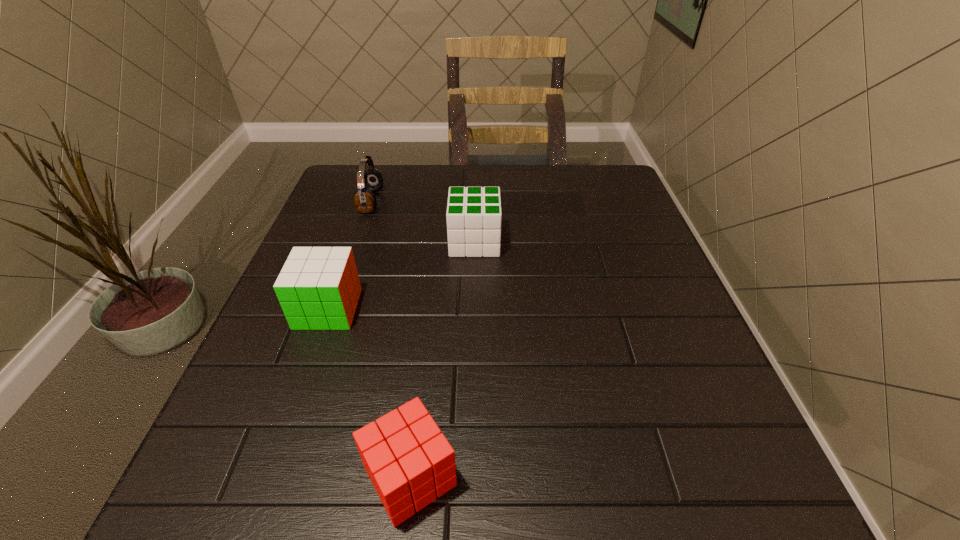
Where is `headset`? headset is located at coordinates (369, 180).

This screenshot has height=540, width=960. In order to click on the farthest cube in this screenshot , I will do pyautogui.click(x=473, y=215).

What are the coordinates of `the second nearest object` in the screenshot? It's located at (318, 288).

You are a GUI agent. You are given a task and a screenshot of the screen. Output one action in this format:
    pyautogui.click(x=<x>, y=<y>)
    Task: Click on the second farthest cube
    
    Given the screenshot: What is the action you would take?
    pyautogui.click(x=318, y=288)

I want to click on the nearest object, so click(409, 461).

What are the coordinates of `the shortest object` in the screenshot? It's located at (409, 461).

Where is `vacant area located 0.330m on the ear cups of the headset`? vacant area located 0.330m on the ear cups of the headset is located at coordinates (506, 201).

Image resolution: width=960 pixels, height=540 pixels. I want to click on free spot located on the red face of the third nearest object, so click(x=525, y=242).

You are a GUI agent. You are given a task and a screenshot of the screen. Output one action in this format:
    pyautogui.click(x=<x>, y=<y>)
    Task: Click on the free space located 0.360m on the back of the leftmost cube
    This screenshot has width=960, height=540.
    Given the screenshot: What is the action you would take?
    pyautogui.click(x=368, y=197)

Identify the location of vacant space located 0.140m on the back of the shortest object. The width and height of the screenshot is (960, 540). (424, 360).